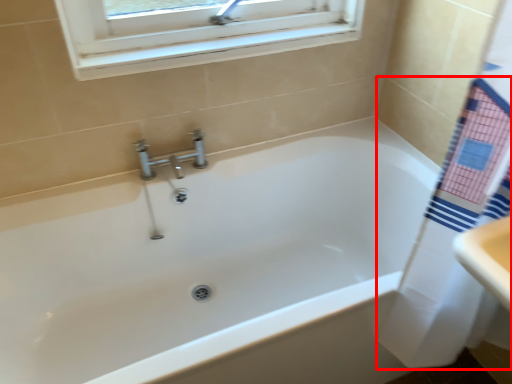
Question: From the image, what is the correct spatial relationship of bath towel (annotated by the red box) in relation to bathtub?

Choices:
 (A) left
 (B) right

Answer: (B)